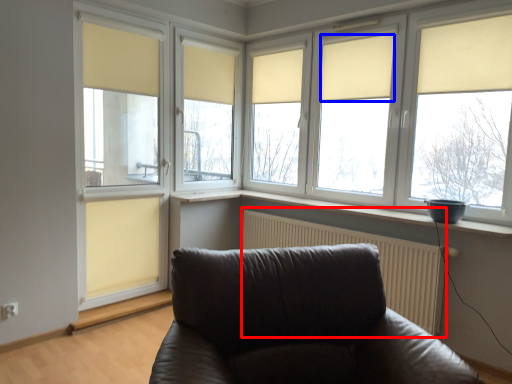
Question: Which point is further to the camera, radiator (highlighted by a red box) or curtain (highlighted by a blue box)?

Choices:
 (A) radiator
 (B) curtain

Answer: (B)